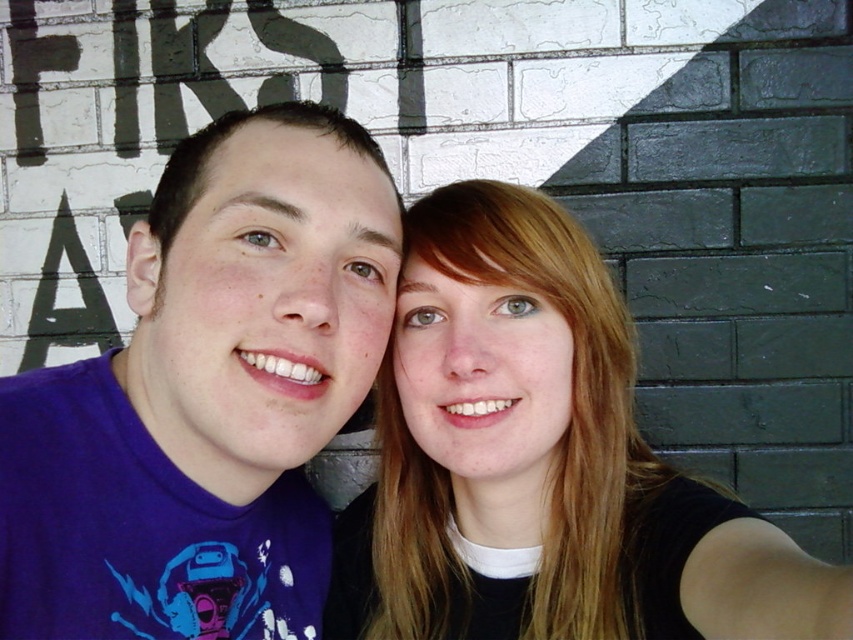
Does purple t-shirt at left have a smaller size compared to smooth blonde hair at center?

Yes.

Which is in front, point (260, 616) or point (506, 545)?

Point (260, 616) is more forward.

Locate an element on the screen. The width and height of the screenshot is (853, 640). purple t-shirt at left is located at coordinates (207, 396).